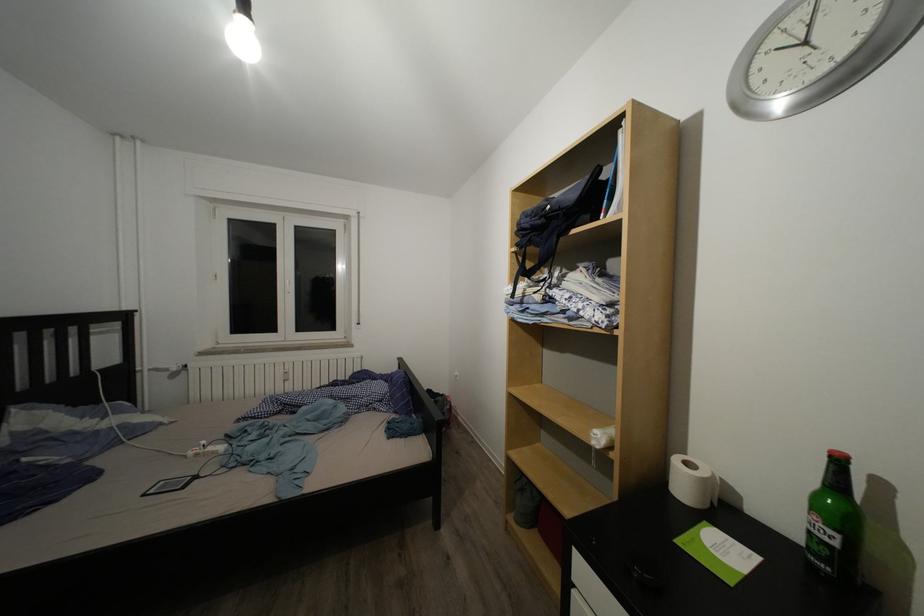
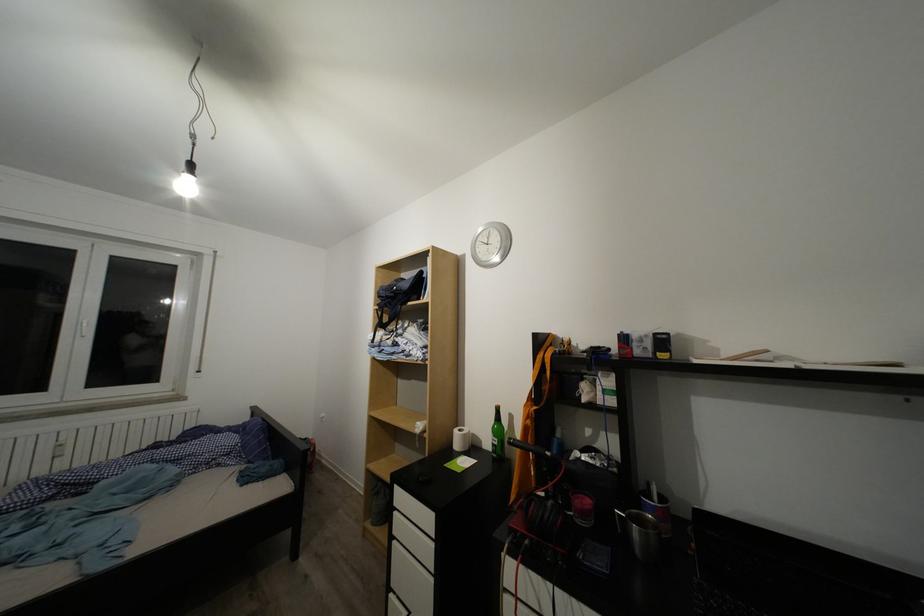
Locate, in the second image, the point that corresponds to (694,469) in the first image.

(468, 436)